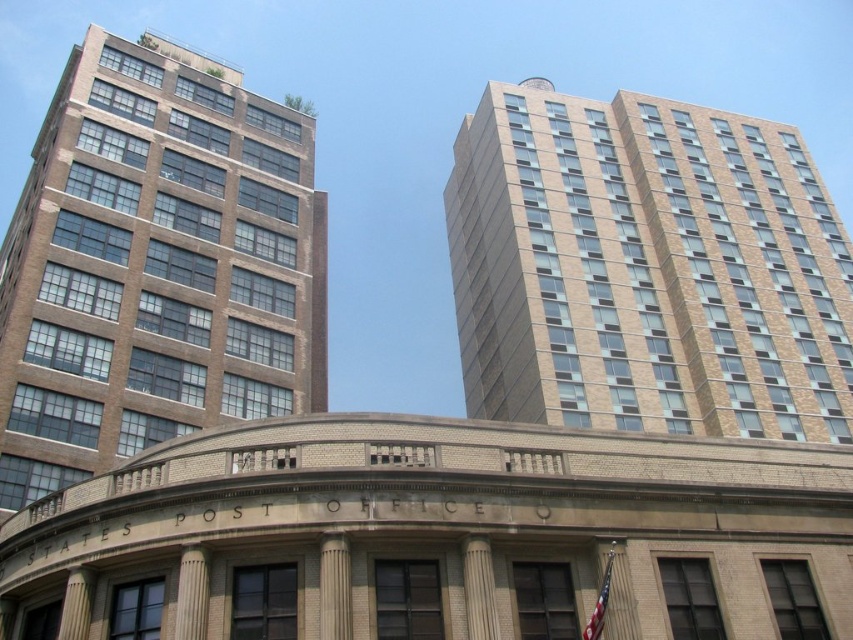
Question: Which object appears closest to the camera in this image?

Choices:
 (A) beige brick building at upper right
 (B) beige stone column at center
 (C) white marble column at lower left

Answer: (B)

Question: Among these objects, which one is farthest from the camera?

Choices:
 (A) white marble column at center
 (B) white marble column at lower left

Answer: (B)

Question: Can you confirm if beige stone column at center is positioned above white marble column at lower left?

Choices:
 (A) yes
 (B) no

Answer: (A)

Question: Does white marble column at center appear over white marble column at lower left?

Choices:
 (A) yes
 (B) no

Answer: (A)

Question: In this image, where is beige brick building at upper right located relative to smooth stone column at center?

Choices:
 (A) below
 (B) above

Answer: (B)

Question: Which point is closer to the camera?

Choices:
 (A) beige stone column at center
 (B) white marble column at lower left
 (C) beige brick building at upper right

Answer: (A)